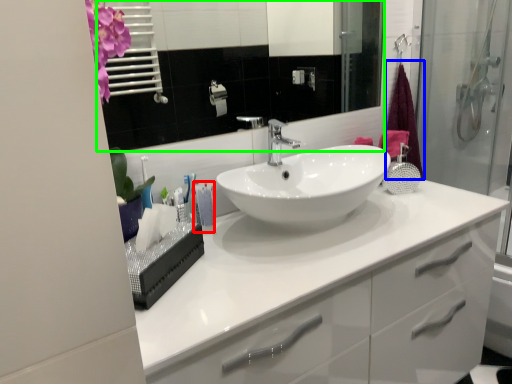
Question: Which object is the farthest from toothpaste (highlighted by a red box)? Choose among these: shower curtain (highlighted by a blue box) or mirror (highlighted by a green box).

Choices:
 (A) shower curtain
 (B) mirror

Answer: (B)